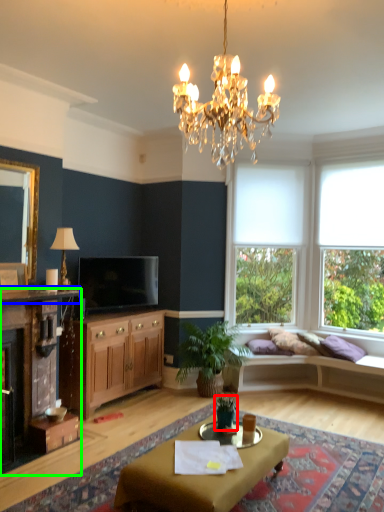
Question: Estimate the real-world distances between objects in this image. Which object is farther from houseplant (highlighted by a red box), mantle (highlighted by a blue box) or cabinet (highlighted by a green box)?

Choices:
 (A) mantle
 (B) cabinet

Answer: (A)